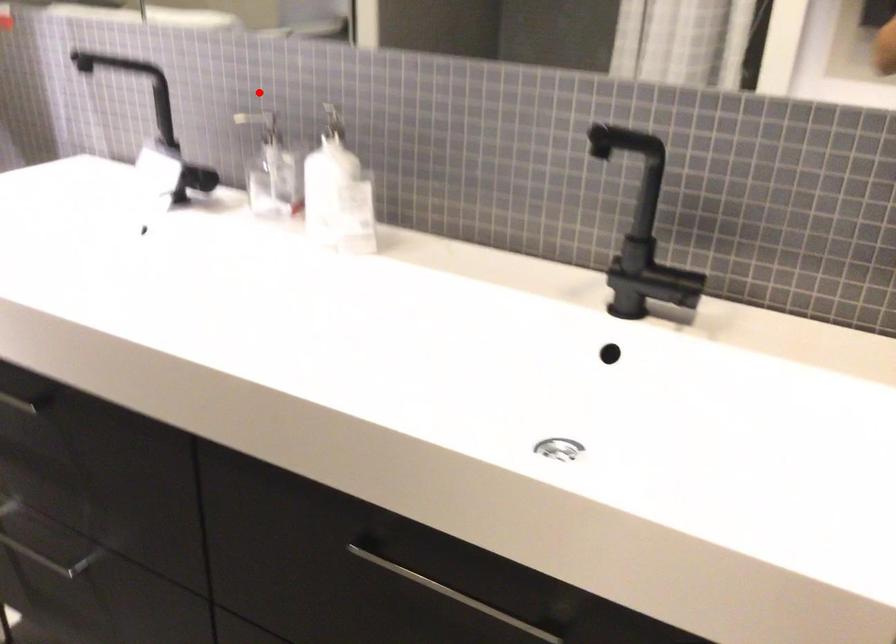
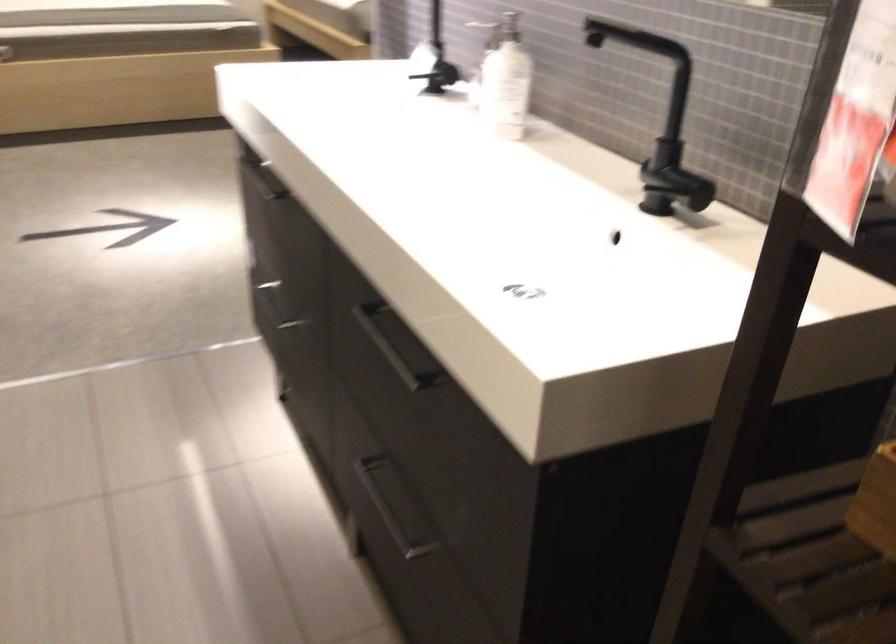
Question: I am providing you with two images of the same scene from different viewpoints. Image1 has a red point marked. In image2, the corresponding 3D location appears at what relative position? Reply with the corresponding letter.

Choices:
 (A) Closer
 (B) Farther

Answer: (B)